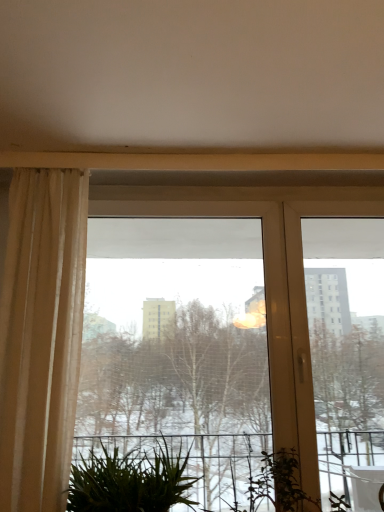
This screenshot has height=512, width=384. Describe the element at coordinates (130, 480) in the screenshot. I see `green leafy plant at lower center` at that location.

Where is `green leafy plant at lower center`? The width and height of the screenshot is (384, 512). green leafy plant at lower center is located at coordinates (130, 480).

Can you confirm if green leafy plant at lower center is positioned to the right of beige sheer curtain at left?

Indeed, green leafy plant at lower center is positioned on the right side of beige sheer curtain at left.

From the image's perspective, is green leafy plant at lower center beneath beige sheer curtain at left?

Yes, from the image's perspective, green leafy plant at lower center is below beige sheer curtain at left.

Between green leafy plant at lower center and beige sheer curtain at left, which one has larger width?

With larger width is green leafy plant at lower center.

Is beige sheer curtain at left located within green leafy plant at lower center?

That's incorrect, beige sheer curtain at left is not inside green leafy plant at lower center.

From the image's perspective, which one is positioned higher, beige sheer curtain at left or green leafy plant at lower center?

beige sheer curtain at left appears higher in the image.

The height and width of the screenshot is (512, 384). In order to click on houseplant behind the beige sheer curtain at left in this screenshot , I will do `click(130, 480)`.

From their relative heights in the image, would you say beige sheer curtain at left is taller or shorter than green leafy plant at lower center?

Clearly, beige sheer curtain at left is taller compared to green leafy plant at lower center.

Does green leafy plant at lower center have a greater width compared to transparent glass window at center?

Correct, the width of green leafy plant at lower center exceeds that of transparent glass window at center.

Is point (152, 487) closer to camera compared to point (277, 356)?

That is True.

From the image's perspective, who appears lower, green leafy plant at lower center or transparent glass window at center?

green leafy plant at lower center is shown below in the image.

Is transparent glass window at center surrounded by green leafy plant at lower center?

No, green leafy plant at lower center does not contain transparent glass window at center.

Is transparent glass window at center in contact with green leafy plant at lower center?

transparent glass window at center and green leafy plant at lower center are not in contact.

Looking at this image, from a real-world perspective, does transparent glass window at center stand above green leafy plant at lower center?

Yes.

Which of these two, transparent glass window at center or green leafy plant at lower center, is smaller?

Smaller between the two is green leafy plant at lower center.

Is beige sheer curtain at left to the left or to the right of transparent glass window at center in the image?

Based on their positions, beige sheer curtain at left is located to the left of transparent glass window at center.

Is transparent glass window at center inside beige sheer curtain at left?

Definitely not — transparent glass window at center is not inside beige sheer curtain at left.

Is beige sheer curtain at left turned away from transparent glass window at center?

No, beige sheer curtain at left is not facing the opposite direction of transparent glass window at center.

From a real-world perspective, is transparent glass window at center beneath beige sheer curtain at left?

Yes, from a real-world perspective, transparent glass window at center is under beige sheer curtain at left.

Is transparent glass window at center not close to beige sheer curtain at left?

Actually, transparent glass window at center and beige sheer curtain at left are a little close together.

In terms of size, does transparent glass window at center appear bigger or smaller than beige sheer curtain at left?

Considering their sizes, transparent glass window at center takes up more space than beige sheer curtain at left.

Where is `curtain lying on the left of green leafy plant at lower center`? Image resolution: width=384 pixels, height=512 pixels. curtain lying on the left of green leafy plant at lower center is located at coordinates (41, 335).

This screenshot has height=512, width=384. I want to click on houseplant below the beige sheer curtain at left (from a real-world perspective), so click(130, 480).

When comparing their distances from beige sheer curtain at left, does transparent glass window at center or green leafy plant at lower center seem closer?

green leafy plant at lower center lies closer to beige sheer curtain at left than the other object.

Looking at the image, which one is located further to green leafy plant at lower center, transparent glass window at center or beige sheer curtain at left?

transparent glass window at center is further to green leafy plant at lower center.

From the image, which object appears to be farther from transparent glass window at center, green leafy plant at lower center or beige sheer curtain at left?

green leafy plant at lower center.

Looking at the image, which one is located closer to beige sheer curtain at left, green leafy plant at lower center or transparent glass window at center?

Among the two, green leafy plant at lower center is located nearer to beige sheer curtain at left.

Estimate the real-world distances between objects in this image. Which object is closer to green leafy plant at lower center, beige sheer curtain at left or transparent glass window at center?

beige sheer curtain at left is closer to green leafy plant at lower center.

When comparing their distances from transparent glass window at center, does beige sheer curtain at left or green leafy plant at lower center seem further?

Based on the image, green leafy plant at lower center appears to be further to transparent glass window at center.

Locate an element on the screen. houseplant located between beige sheer curtain at left and transparent glass window at center in the left-right direction is located at coordinates (130, 480).